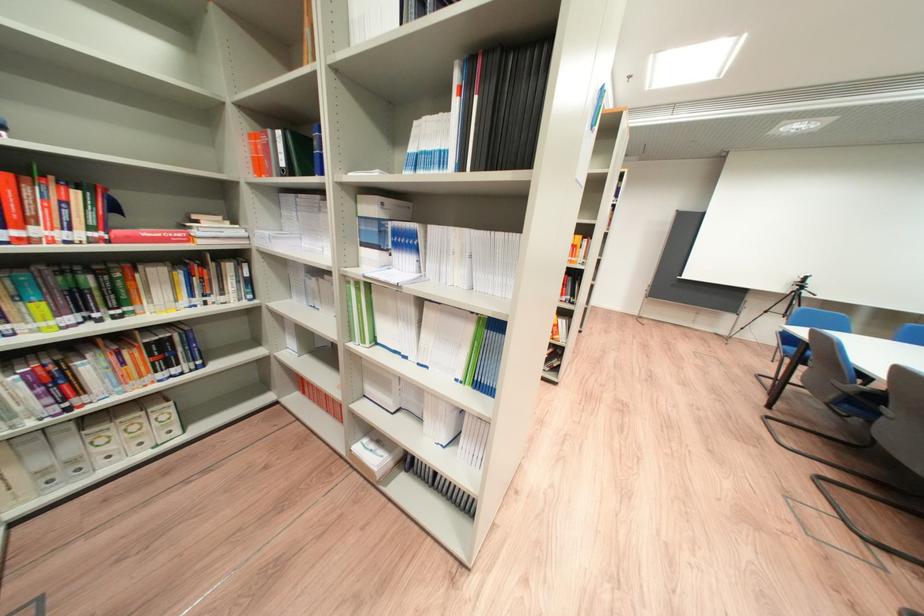
This screenshot has height=616, width=924. What do you see at coordinates (13, 208) in the screenshot?
I see `the red book` at bounding box center [13, 208].